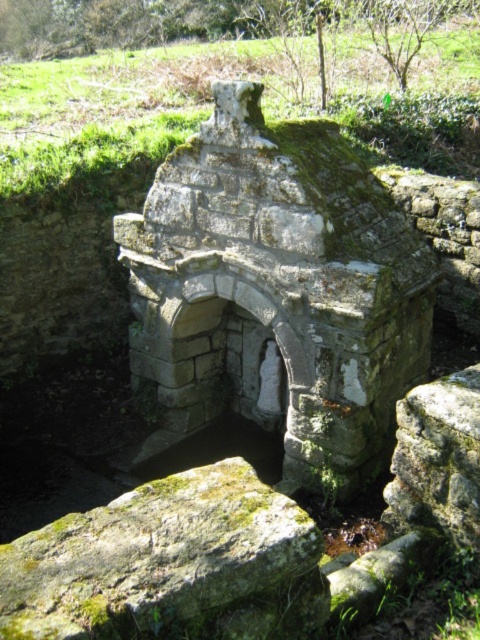
You are an archaeologist examining the ancient stone structure. You notice a green mossy stone at center. Can you determine its exact location within the structure?

The green mossy stone at center is located at point coordinates of (277, 291).

You are an archaeologist examining the ancient stone structure. You notice a point marked at coordinates (170, 564). Based on the scene, what object is located at this point?

The point at coordinates (170, 564) indicates the green mossy rock at lower left.

You are an archaeologist examining the ancient stone structure. You notice a specific point marked at coordinates [277,291]. What object is located at that point?

The point at coordinates [277,291] is where the green mossy stone at center is located.